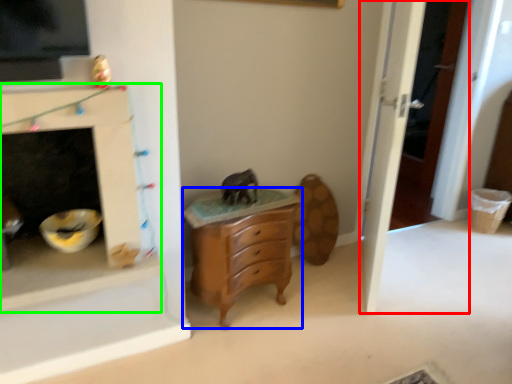
Question: Which object is the closest to the door (highlighted by a red box)? Choose among these: chest of drawers (highlighted by a blue box) or fireplace (highlighted by a green box).

Choices:
 (A) chest of drawers
 (B) fireplace

Answer: (A)